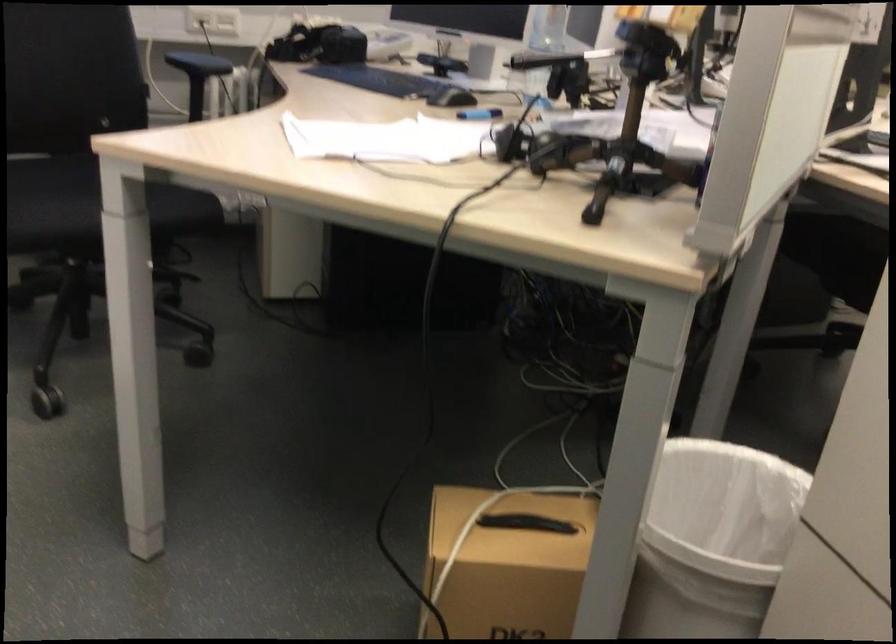
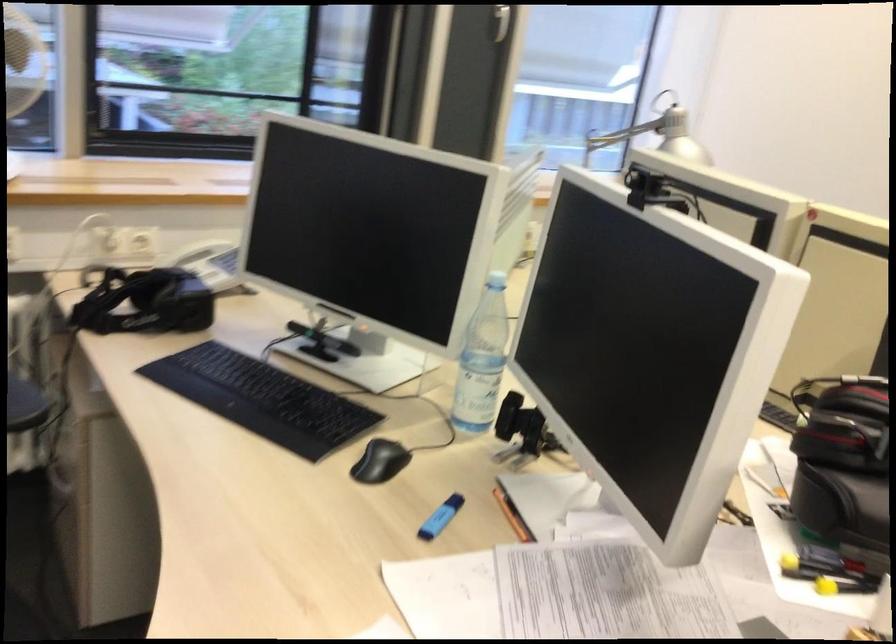
In a continuous first-person perspective shot, in which direction is the camera moving?

The cameraman moved toward left, forward.